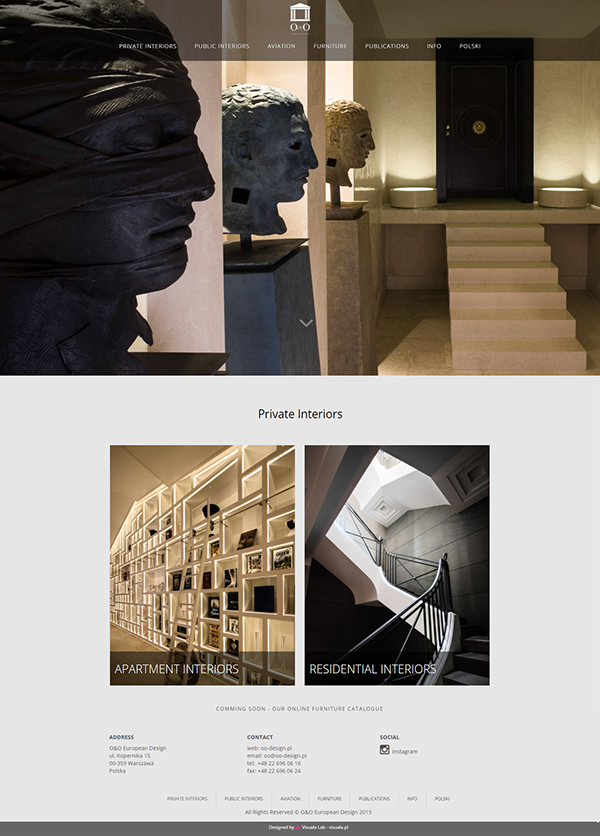
At what (x,y) coordinates should I click in order to perform the action: click on white staircase. Please return your answer as a coordinate pair (x, y). The height and width of the screenshot is (836, 600). Looking at the image, I should click on (496, 247), (498, 298), (501, 344).